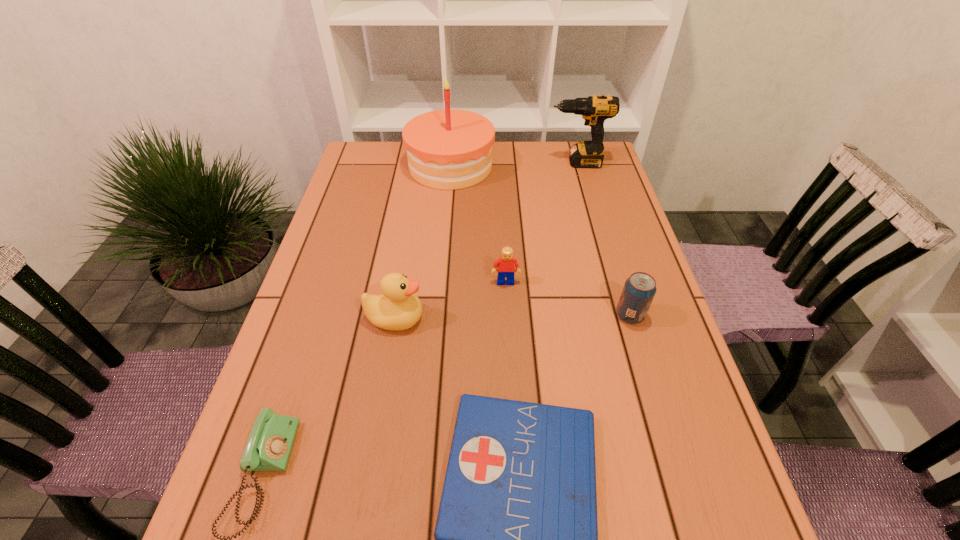
The height and width of the screenshot is (540, 960). In order to click on vacant space that satisfies the following two spatial constraints: 1. on the front-facing side of the fifth nearest object; 2. on the left side of the pop soda in this screenshot , I will do `click(508, 315)`.